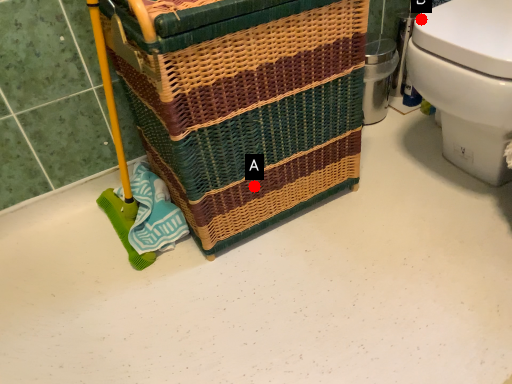
Question: Two points are circled on the image, labeled by A and B beside each circle. Among these points, which one is farthest from the camera?

Choices:
 (A) A is further
 (B) B is further

Answer: (B)